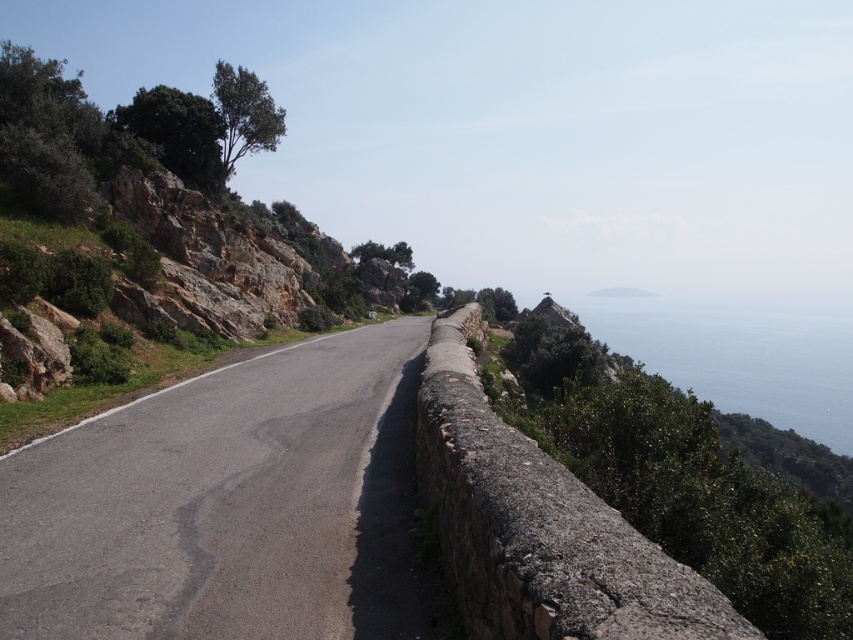
Does asphalt road at center have a lesser height compared to blue water at upper right?

Yes.

Does asphalt road at center have a larger size compared to blue water at upper right?

Incorrect, asphalt road at center is not larger than blue water at upper right.

You are a GUI agent. You are given a task and a screenshot of the screen. Output one action in this format:
    pyautogui.click(x=<x>, y=<y>)
    Task: Click on the asphalt road at center
    
    Given the screenshot: What is the action you would take?
    pyautogui.click(x=227, y=504)